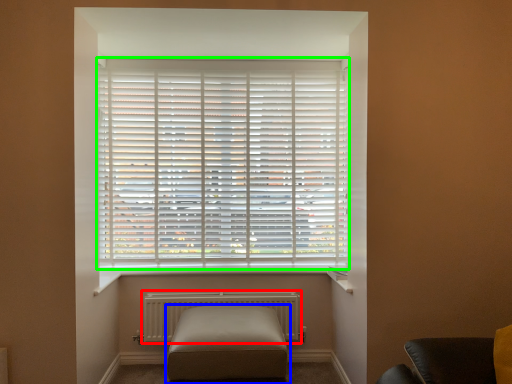
Question: Which object is positioned closest to radiator (highlighted by a red box)? Select from furniture (highlighted by a blue box) and window blind (highlighted by a green box).

Choices:
 (A) furniture
 (B) window blind

Answer: (A)